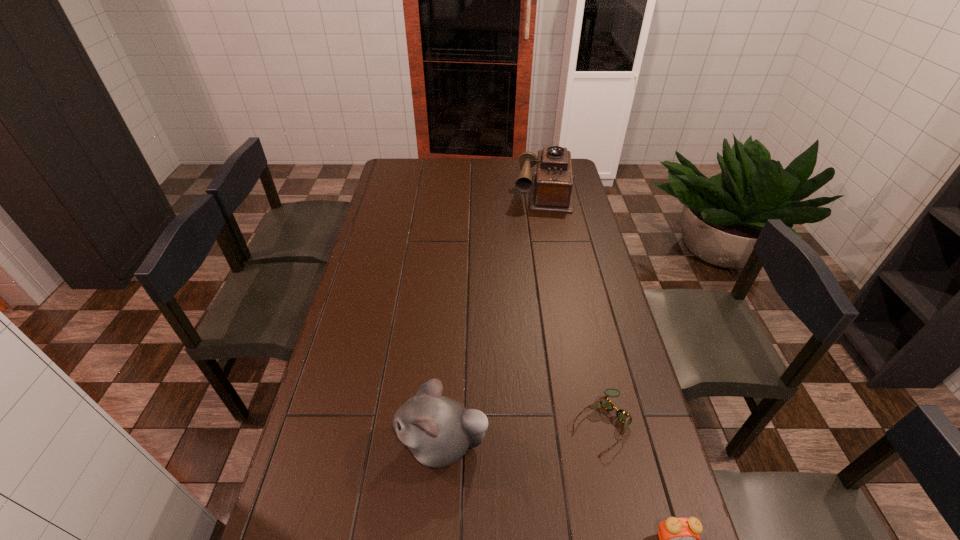
The image size is (960, 540). Identify the location of free spot between the spectacles and the hamster. (521, 434).

The height and width of the screenshot is (540, 960). I want to click on free space between the hamster and the shortest object, so click(521, 434).

Identify the location of empty location between the hamster and the shortest object. (521, 434).

I want to click on empty location between the spectacles and the phonograph_record, so click(x=572, y=307).

Identify the location of vacant point located between the farthest object and the hamster. The width and height of the screenshot is (960, 540). pyautogui.click(x=493, y=318).

Find the location of a particular element. The height and width of the screenshot is (540, 960). object that is the nearest to the spectacles is located at coordinates (679, 539).

Locate which object ranks in proximity to the farthest object. Please provide its 2D coordinates. Your answer should be formatted as a tuple, i.e. [(x, y)], where the tuple contains the x and y coordinates of a point satisfying the conditions above.

[(622, 415)]